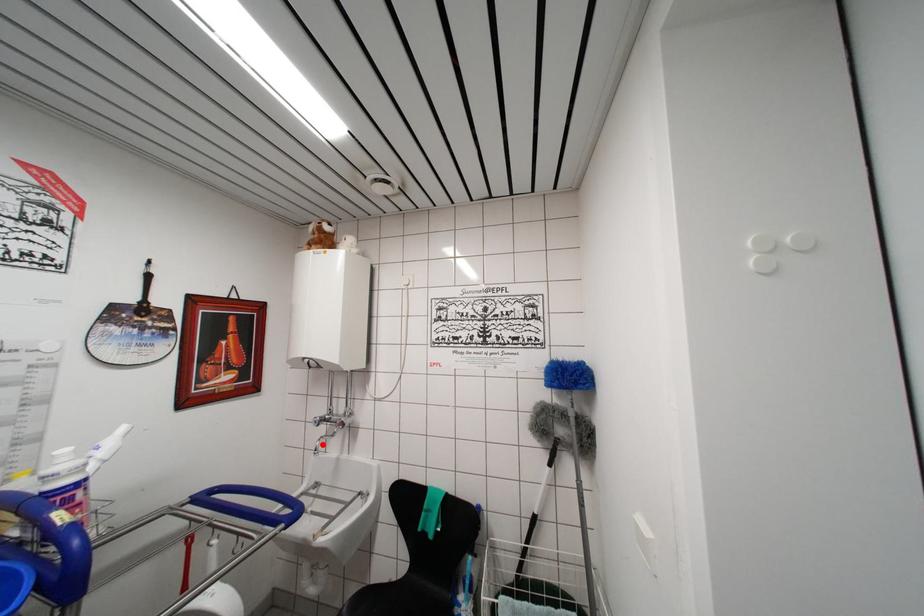
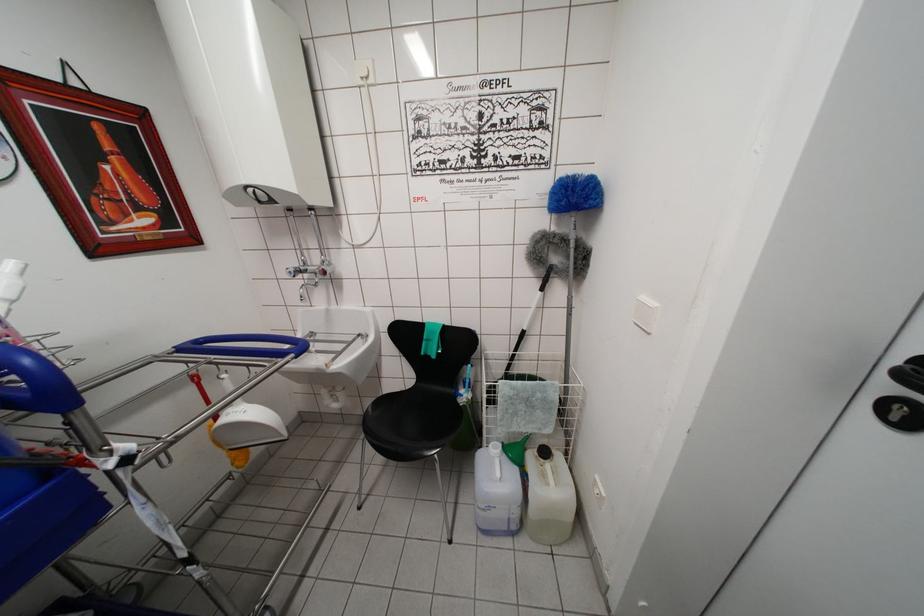
Question: I am providing you with two images of the same scene from different viewpoints. Given a red point in image1, look at the same physical point in image2. Is it:

Choices:
 (A) Closer to the viewpoint
 (B) Farther from the viewpoint

Answer: (A)